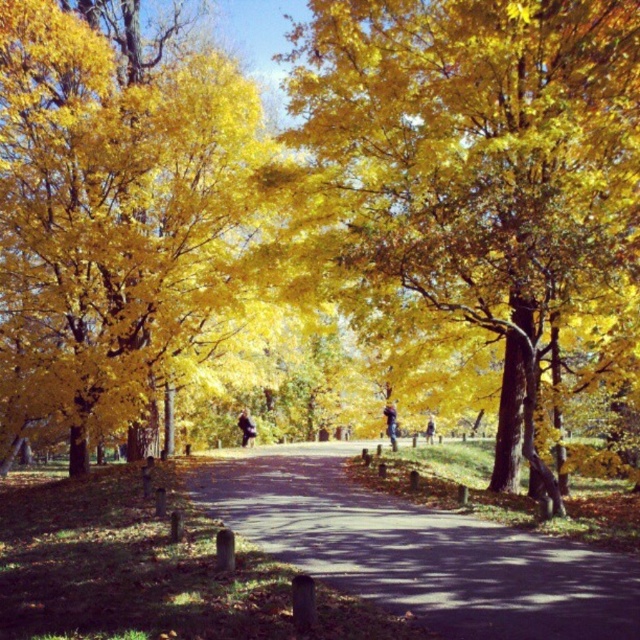
Question: Can you confirm if golden leafy tree at center is positioned to the left of golden yellow leaves at upper left?

Choices:
 (A) yes
 (B) no

Answer: (B)

Question: Based on their relative distances, which object is farther from the blue denim jeans at center?

Choices:
 (A) golden yellow leaves at upper left
 (B) dark blue jeans at center

Answer: (A)

Question: Which object is closer to the camera taking this photo?

Choices:
 (A) dark asphalt path at center
 (B) golden leafy tree at center
 (C) dark blue jeans at center
 (D) golden yellow leaves at upper left

Answer: (A)

Question: Does golden leafy tree at center appear under dark asphalt path at center?

Choices:
 (A) yes
 (B) no

Answer: (B)

Question: Can you confirm if golden leafy tree at center is bigger than golden yellow leaves at upper left?

Choices:
 (A) yes
 (B) no

Answer: (B)

Question: Which object appears farthest from the camera in this image?

Choices:
 (A) dark blue jeans at center
 (B) golden leafy tree at center
 (C) dark asphalt path at center

Answer: (A)